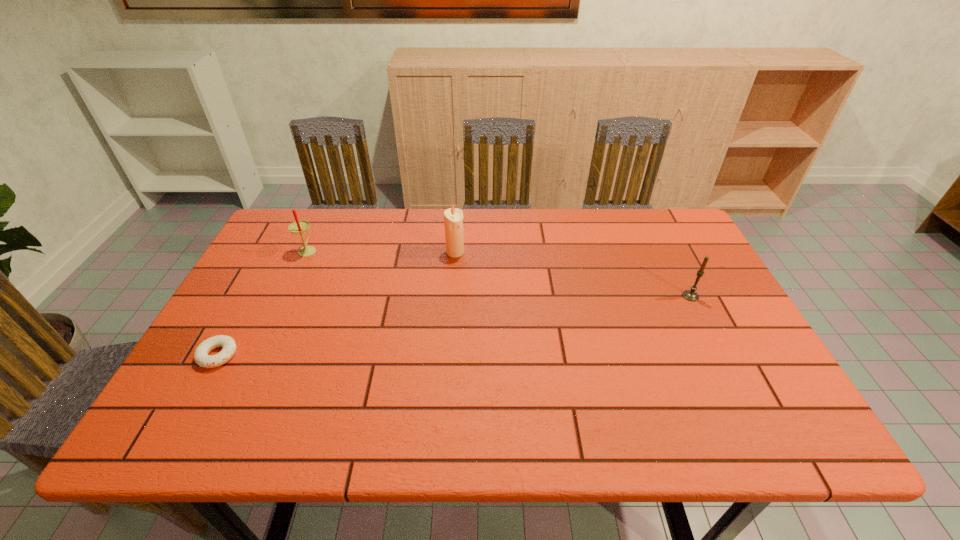
Locate an element on the screen. The height and width of the screenshot is (540, 960). object that can be found as the third closest to the nearest object is located at coordinates (691, 295).

Identify which candle is the third closest to the shortest object. Please provide its 2D coordinates. Your answer should be formatted as a tuple, i.e. [(x, y)], where the tuple contains the x and y coordinates of a point satisfying the conditions above.

[(691, 295)]

Locate an element on the screen. This screenshot has width=960, height=540. the closest candle to the rightmost object is located at coordinates (453, 218).

This screenshot has width=960, height=540. I want to click on free region that satisfies the following two spatial constraints: 1. on the back side of the nearest object; 2. on the left side of the rightmost candle, so click(x=251, y=296).